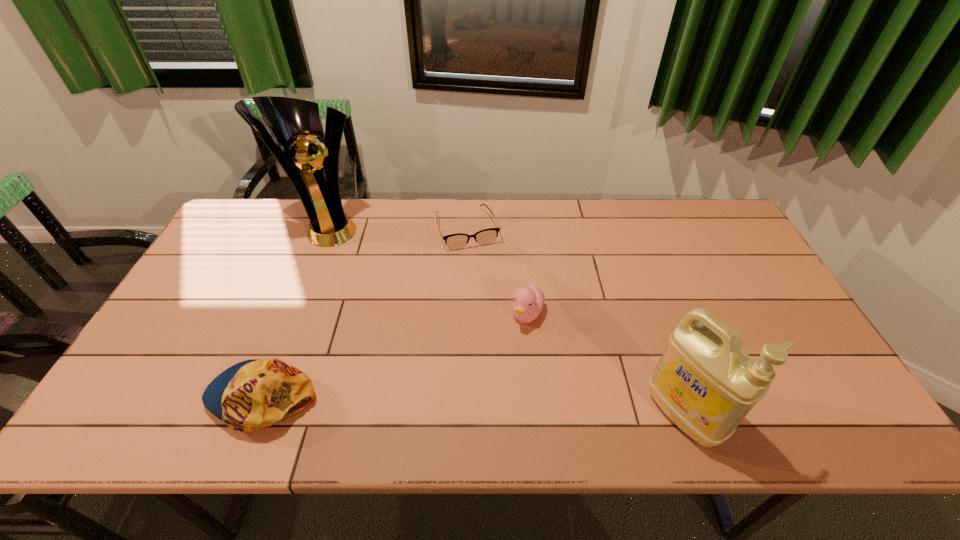
Find the location of a particular element. The height and width of the screenshot is (540, 960). free space on the desktop that is between the cap and the rightmost object and is positioned at the front of the award, where the globe is visible is located at coordinates (485, 406).

Locate an element on the screen. The height and width of the screenshot is (540, 960). free spot on the desktop that is between the cap and the fourth shortest object and is positioned on the front-facing side of the duckling is located at coordinates (487, 406).

Image resolution: width=960 pixels, height=540 pixels. Find the location of `vacant space on the desktop that is between the cap and the detergent and is positioned on the face of the third object from right to left`. vacant space on the desktop that is between the cap and the detergent and is positioned on the face of the third object from right to left is located at coordinates (532, 407).